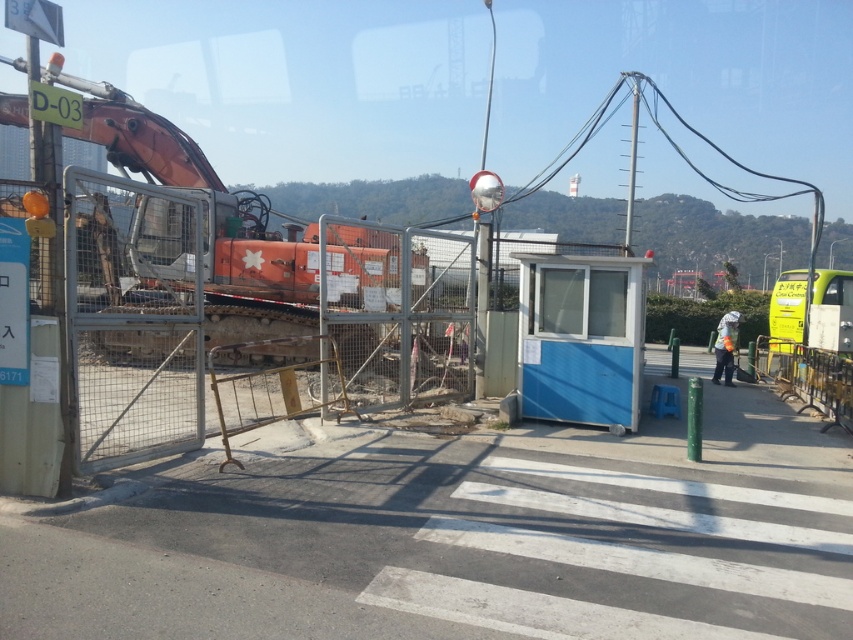
You are a delivery driver approaching the construction site. You need to park your vehicle near the orange metallic excavator at left and the blue plastic booth at center. Which object should you park closer to if you want to be as close as possible to both without choosing one over the other?

Since the orange metallic excavator at left is closer to the viewer than the blue plastic booth at center, you should park your vehicle in between them to be equidistant from both objects.

Consider the image. You are a delivery driver who needs to park your truck near the blue plastic booth at center and reflective orange vest at center. Since the parking space is narrow, can you park between them without touching either?

The blue plastic booth at center is thinner than the reflective orange vest at center. However, the reflective orange vest at center is worn by a person, so it is not a fixed object. Therefore, you cannot reliably park between them as the vest moves with the person.